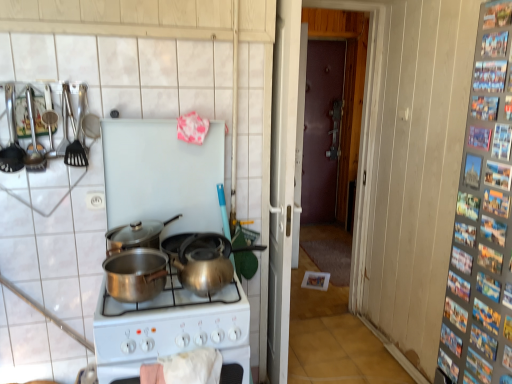
Question: From a real-world perspective, is shiny silver wok at center physically located above or below shiny silver pot at center, which is the third kitchen appliance from left to right?

Choices:
 (A) above
 (B) below

Answer: (B)

Question: Does point [216, 238] appear closer or farther from the camera than point [138, 223]?

Choices:
 (A) farther
 (B) closer

Answer: (A)

Question: Which is farther from the metallic utensils at upper left, the 2th kitchen appliance positioned from the left?

Choices:
 (A) white plastic screen door at center
 (B) shiny metallic kettle at center
 (C) shiny silver wok at center
 (D) dark brown wood door at center
 (E) polished stainless steel pot at center, the fourth kitchen appliance from the left

Answer: (D)

Question: Estimate the real-world distances between objects in this image. Which object is closer to the shiny metallic kettle at center?

Choices:
 (A) white plastic screen door at center
 (B) dark brown wood door at center
 (C) metallic utensils at upper left, which appears as the third kitchen appliance when viewed from the right
 (D) shiny metallic kettle at center
 (E) shiny silver pot at center, which is the third kitchen appliance from left to right

Answer: (D)